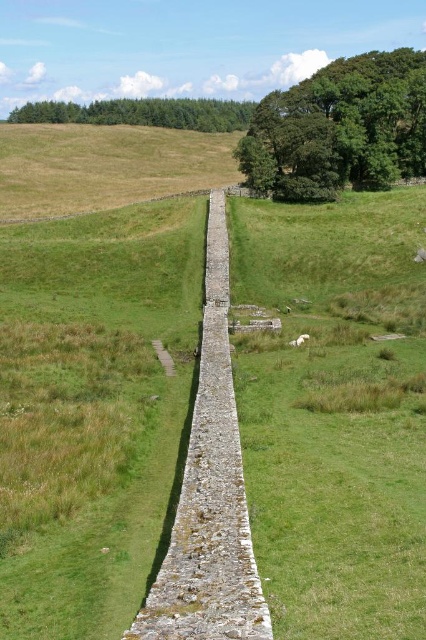
Does gray stone wall at center have a lesser width compared to green textured trees at upper center?

Correct, gray stone wall at center's width is less than green textured trees at upper center's.

Does gray stone wall at center appear on the left side of green textured trees at upper center?

No, gray stone wall at center is not to the left of green textured trees at upper center.

Is point (201, 579) positioned after point (141, 124)?

That is False.

This screenshot has height=640, width=426. Find the location of `gray stone wall at center`. gray stone wall at center is located at coordinates (210, 493).

The height and width of the screenshot is (640, 426). Describe the element at coordinates (210, 493) in the screenshot. I see `gray stone wall at center` at that location.

Can you confirm if gray stone wall at center is thinner than green leafy tree at upper right?

Indeed, gray stone wall at center has a lesser width compared to green leafy tree at upper right.

Where is `gray stone wall at center`? This screenshot has width=426, height=640. gray stone wall at center is located at coordinates [x=210, y=493].

Where is `gray stone wall at center`? The height and width of the screenshot is (640, 426). gray stone wall at center is located at coordinates (210, 493).

Is the position of green leafy tree at upper right more distant than that of green textured trees at upper center?

No.

Measure the distance between green leafy tree at upper right and camera.

The distance of green leafy tree at upper right from camera is 78.91 meters.

At what (x,y) coordinates should I click in order to perform the action: click on green leafy tree at upper right. Please return your answer as a coordinate pair (x, y). Image resolution: width=426 pixels, height=640 pixels. Looking at the image, I should click on (339, 129).